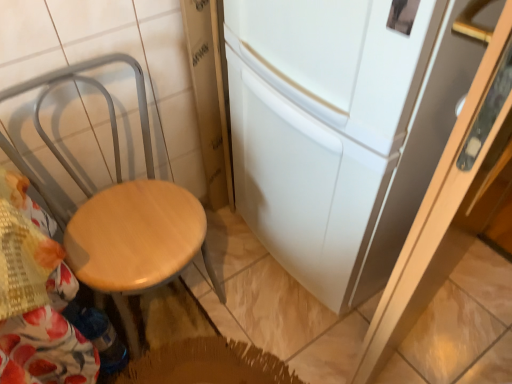
Where is `vacant space that is in between white matte refrigerator at center and wooden seat at left`? vacant space that is in between white matte refrigerator at center and wooden seat at left is located at coordinates (245, 305).